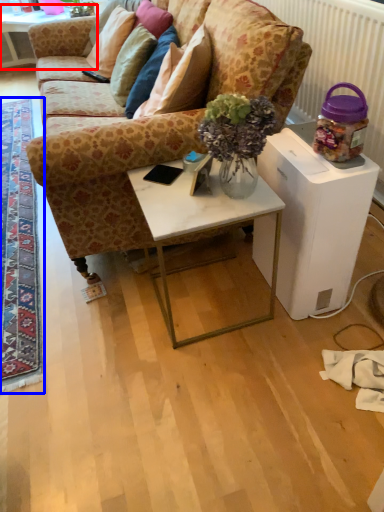
Question: Which point is closer to the camera, table (highlighted by a red box) or mat (highlighted by a blue box)?

Choices:
 (A) table
 (B) mat

Answer: (B)